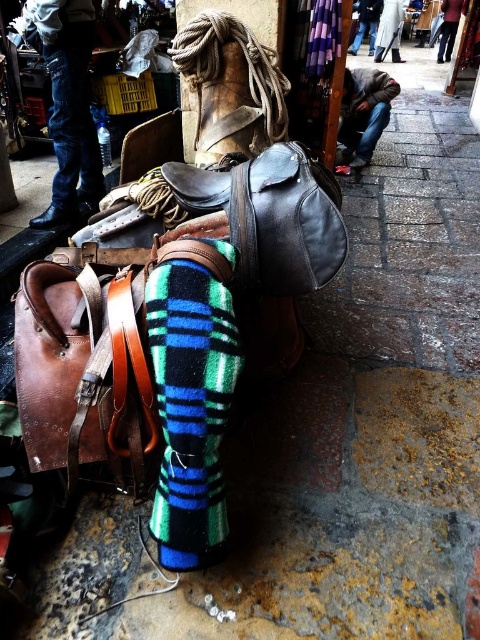
You are a delivery person who needs to place a small package between the black leather shoe at lower left and the brown leather shoe at lower center. Can you fit it there?

The distance between the black leather shoe at lower left and the brown leather shoe at lower center is 7.43 feet, so yes, the package can fit there as the space is more than sufficient.

You are a customer at the market and want to buy a pair of shoes. You see the green plaid sock at center and the black leather shoe at lower left. Which item is taller?

The green plaid sock at center is taller than the black leather shoe at lower left.

You are a customer at the market and see the green plaid sock at center and the black leather shoe at lower left. Which item is positioned closer to the ground?

The green plaid sock at center is located below the black leather shoe at lower left, so it is closer to the ground.